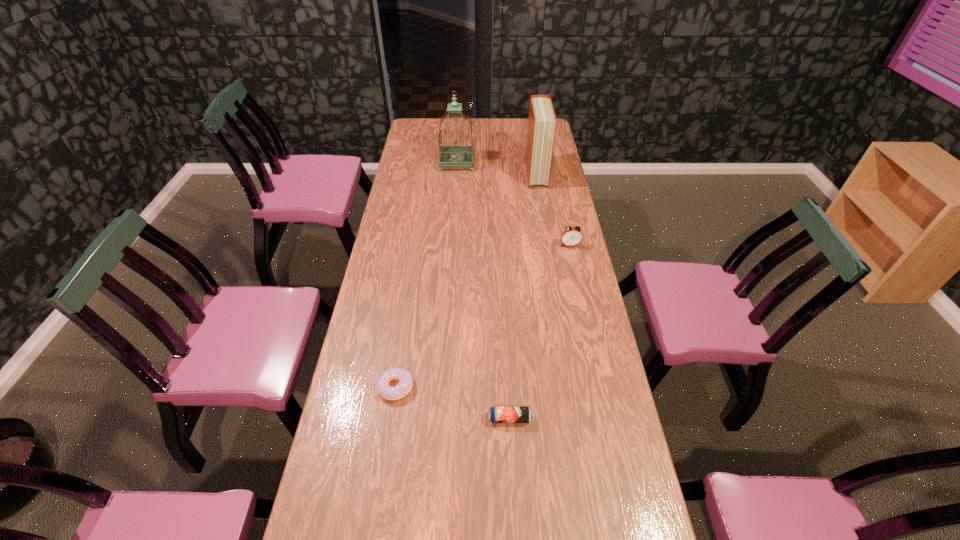
The width and height of the screenshot is (960, 540). Identify the location of blank space located 0.200m on the left of the beer can. (418, 419).

Where is `free space located on the right of the doughnut`? The height and width of the screenshot is (540, 960). free space located on the right of the doughnut is located at coordinates (441, 387).

Identify the location of object that is at the left edge. This screenshot has width=960, height=540. (405, 384).

I want to click on hardback book that is at the right edge, so pos(542,121).

I want to click on alarm clock situated at the right edge, so click(572, 236).

The image size is (960, 540). Find the location of `vacant area at the left edge of the desktop`. vacant area at the left edge of the desktop is located at coordinates (406, 237).

The height and width of the screenshot is (540, 960). I want to click on blank space at the right edge of the desktop, so click(561, 274).

Where is `free space between the fourth farthest object and the nearest object`? This screenshot has height=540, width=960. free space between the fourth farthest object and the nearest object is located at coordinates (452, 403).

Find the location of a particular element. unoccupied position between the doughnut and the rightmost object is located at coordinates (483, 316).

Image resolution: width=960 pixels, height=540 pixels. I want to click on vacant space in between the second nearest object and the third tallest object, so click(483, 316).